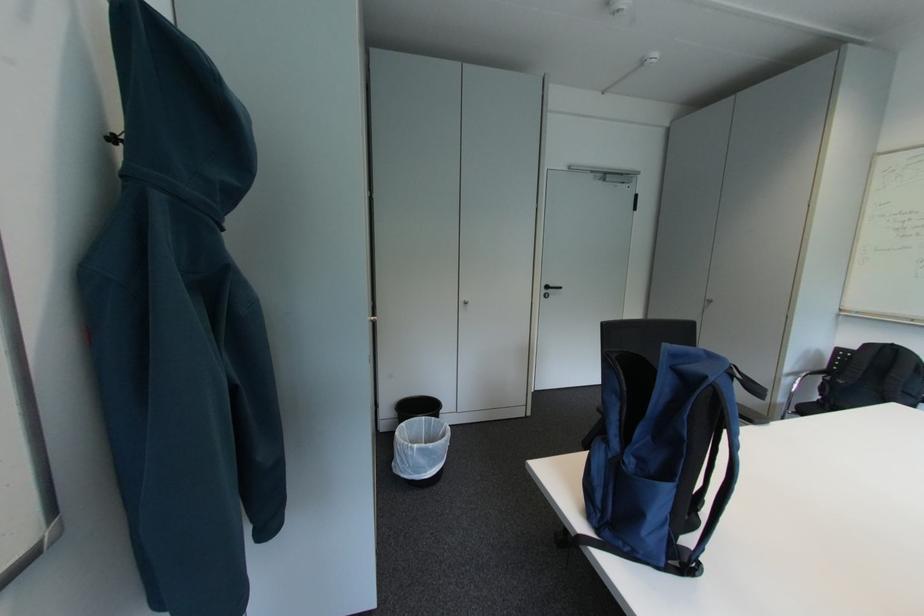
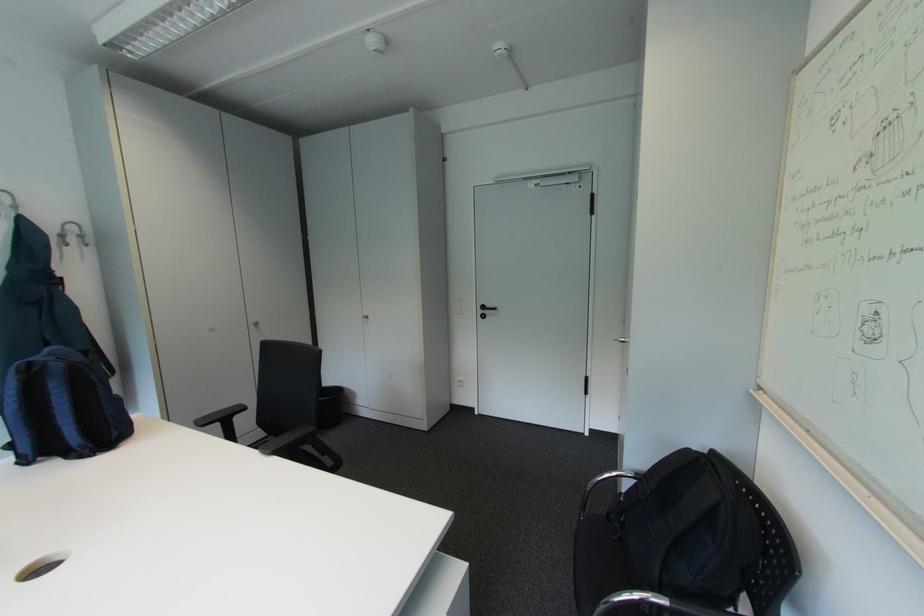
In the second image, find the point that corresponds to point 560,293 in the first image.

(495, 314)